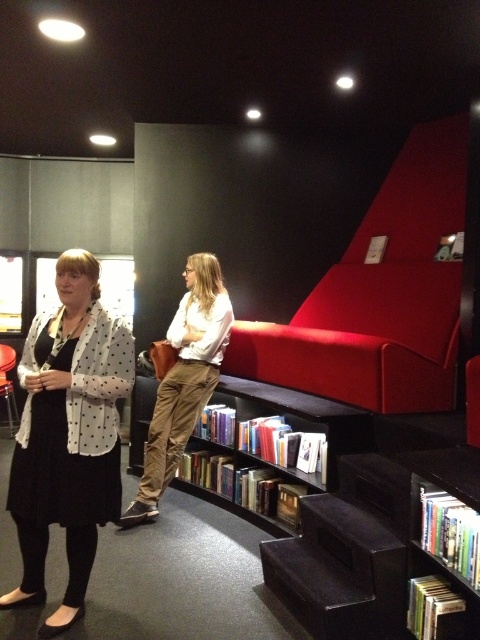
You are an assistant helping someone find a book in the library. You notice a person wearing a white dotted blazer at center and another wearing a matte white blouse at center. Which clothing item is closer to you?

The white dotted blazer at center is closer to you because it is in front of the matte white blouse at center.